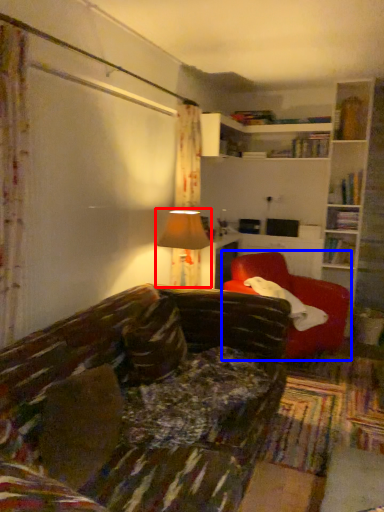
Question: Which object is further to the camera taking this photo, table lamp (highlighted by a red box) or chair (highlighted by a blue box)?

Choices:
 (A) table lamp
 (B) chair

Answer: (B)